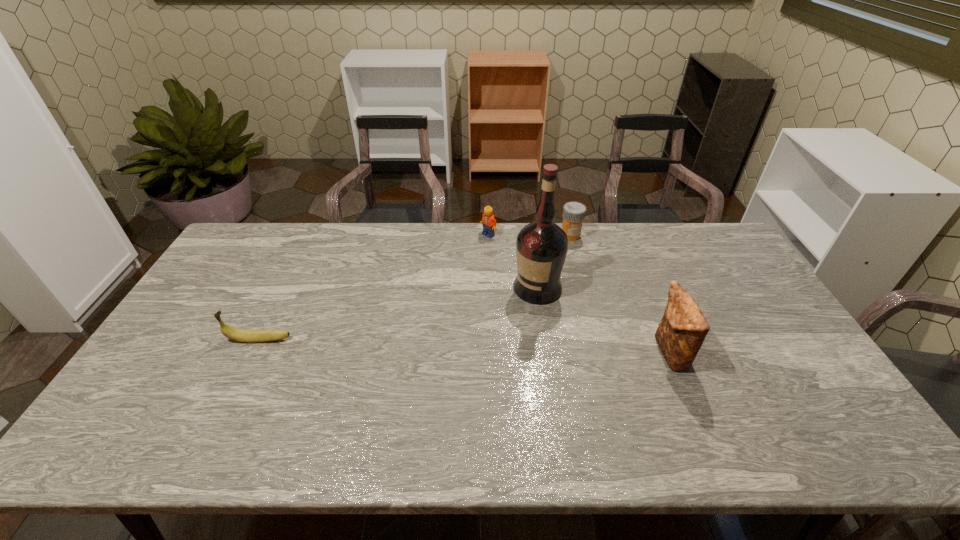
Identify the location of vacant space that's between the banana and the third object from right to left. (398, 314).

Identify the location of free space between the leftmost object and the third object from right to left. (398, 314).

You are a GUI agent. You are given a task and a screenshot of the screen. Output one action in this format:
    pyautogui.click(x=<x>, y=<y>)
    Task: Click on the free area in between the liquor and the leftmost object
    This screenshot has height=540, width=960.
    Given the screenshot: What is the action you would take?
    pyautogui.click(x=398, y=314)

Image resolution: width=960 pixels, height=540 pixels. Identify the location of vacant area that lies between the Lego and the liquor. (513, 261).

The height and width of the screenshot is (540, 960). I want to click on vacant space that's between the second tallest object and the Lego, so click(579, 294).

This screenshot has height=540, width=960. What are the coordinates of `free spot between the tallest object and the Lego` in the screenshot? It's located at (513, 261).

Image resolution: width=960 pixels, height=540 pixels. Find the location of `vacant region between the leftmost object and the tallest object`. vacant region between the leftmost object and the tallest object is located at coordinates (398, 314).

Locate an element on the screen. This screenshot has width=960, height=540. free spot between the Lego and the third nearest object is located at coordinates click(513, 261).

Image resolution: width=960 pixels, height=540 pixels. Identify the location of free space that is in between the third nearest object and the Lego. click(513, 261).

Image resolution: width=960 pixels, height=540 pixels. In order to click on object that stands as the second closest to the banana in this screenshot , I will do `click(489, 223)`.